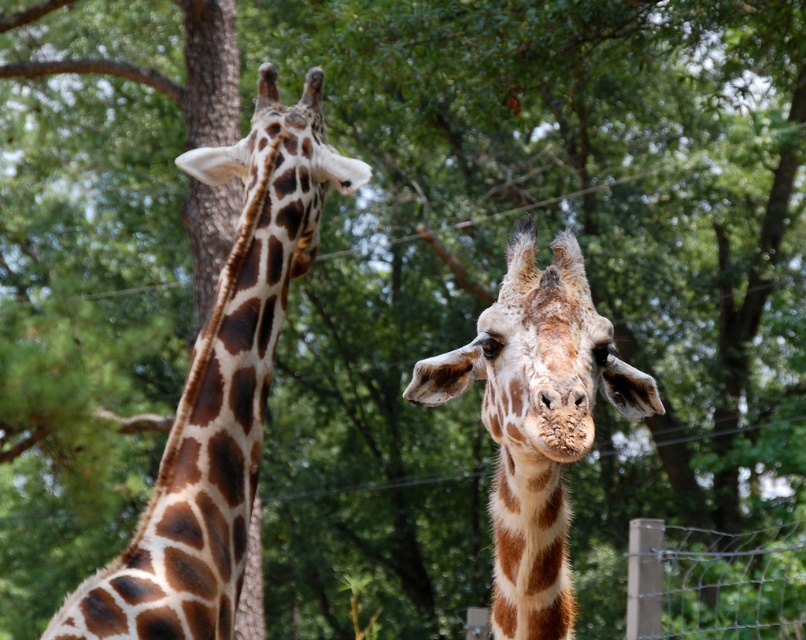
Question: Which object appears farthest from the camera in this image?

Choices:
 (A) wire mesh fence at lower right
 (B) brown spotted giraffe at left

Answer: (A)

Question: Is brown spotted giraffe at left wider than wire mesh fence at lower right?

Choices:
 (A) no
 (B) yes

Answer: (A)

Question: Which is nearer to the wire mesh fence at lower right?

Choices:
 (A) brown spotted giraffe at center
 (B) brown spotted giraffe at left

Answer: (B)

Question: Does brown spotted giraffe at center appear on the right side of wire mesh fence at lower right?

Choices:
 (A) yes
 (B) no

Answer: (B)

Question: Can you confirm if brown spotted giraffe at left is smaller than wire mesh fence at lower right?

Choices:
 (A) yes
 (B) no

Answer: (B)

Question: Which of the following is the closest to the observer?

Choices:
 (A) (181, 554)
 (B) (686, 620)
 (C) (532, 476)

Answer: (C)